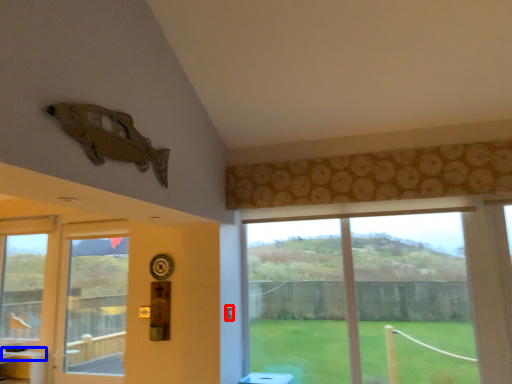
Question: Which point is closer to the camera, door handle (highlighted by a red box) or counter top (highlighted by a blue box)?

Choices:
 (A) door handle
 (B) counter top

Answer: (A)